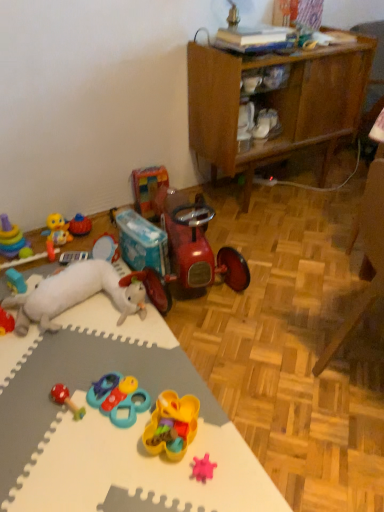
Image resolution: width=384 pixels, height=512 pixels. I want to click on empty space that is in between teal plastic toy at center, the eighth toy viewed from the left, and white plush toy at upper left, the eighth toy when ordered from right to left, so click(x=104, y=356).